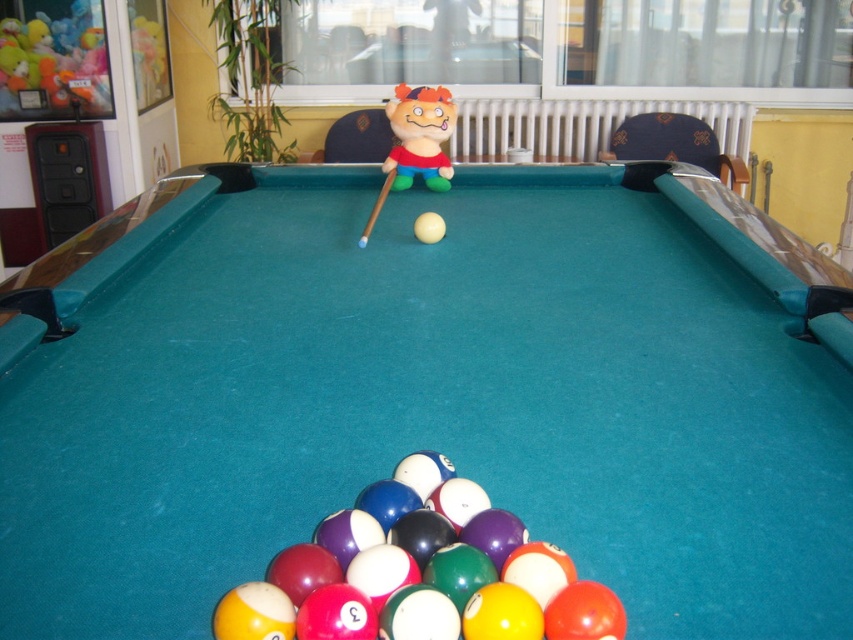
Does teal felt billiard table at center have a greater width compared to wooden at center?

Correct, the width of teal felt billiard table at center exceeds that of wooden at center.

Does teal felt billiard table at center appear over wooden at center?

No, teal felt billiard table at center is not above wooden at center.

Image resolution: width=853 pixels, height=640 pixels. Describe the element at coordinates (428, 392) in the screenshot. I see `teal felt billiard table at center` at that location.

This screenshot has height=640, width=853. Identify the location of teal felt billiard table at center. (428, 392).

Is teal felt billiard table at center shorter than plush toy at center?

No, teal felt billiard table at center is not shorter than plush toy at center.

Measure the distance between teal felt billiard table at center and plush toy at center.

They are 36.06 inches apart.

What do you see at coordinates (428, 392) in the screenshot? I see `teal felt billiard table at center` at bounding box center [428, 392].

Where is `teal felt billiard table at center`? The width and height of the screenshot is (853, 640). teal felt billiard table at center is located at coordinates 428,392.

Is plush toy at center taller than wooden at center?

Yes, plush toy at center is taller than wooden at center.

Is plush toy at center positioned before wooden at center?

No, it is not.

Between point (399, 122) and point (376, 216), which one is positioned behind?

The point (399, 122) is behind.

Find the location of a particular element. plush toy at center is located at coordinates (419, 134).